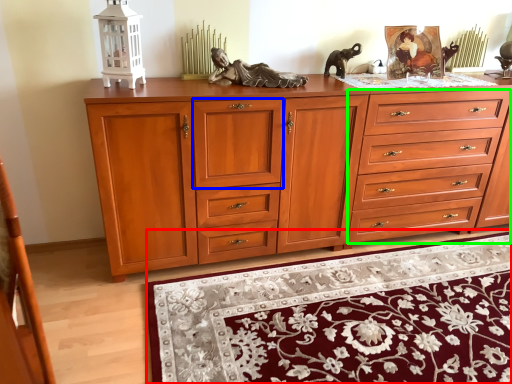
Question: Which object is positioned closest to mat (highlighted by a red box)? Select from drawer (highlighted by a blue box) and drawer (highlighted by a green box).

Choices:
 (A) drawer
 (B) drawer

Answer: (B)